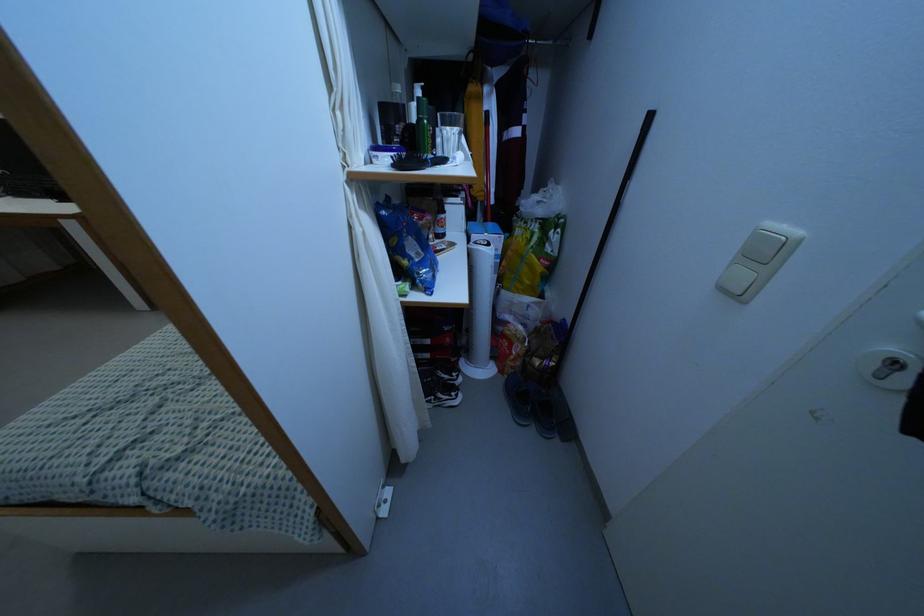
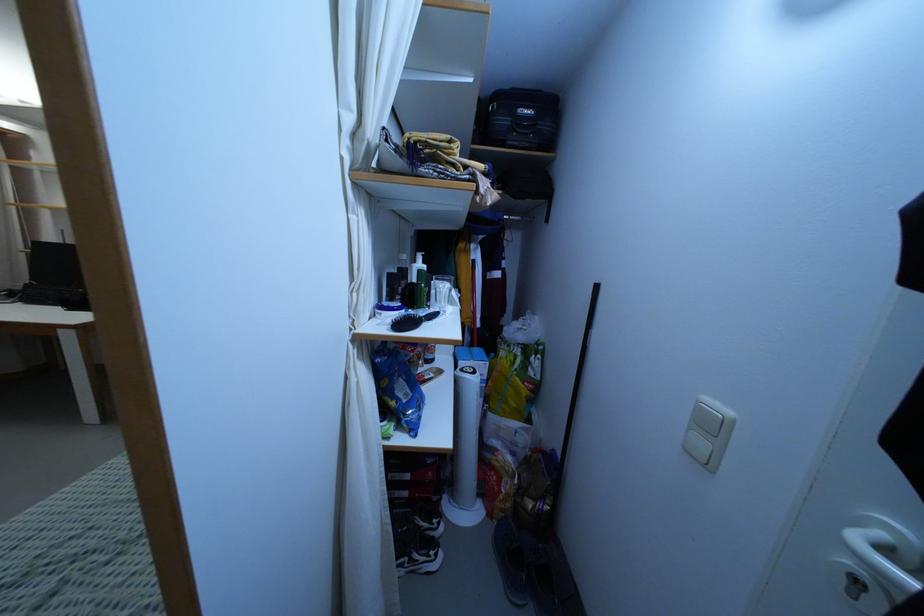
Question: The first image is from the beginning of the video and the second image is from the end. How did the camera likely rotate when shooting the video?

Choices:
 (A) Left
 (B) Right
 (C) Up
 (D) Down

Answer: (C)